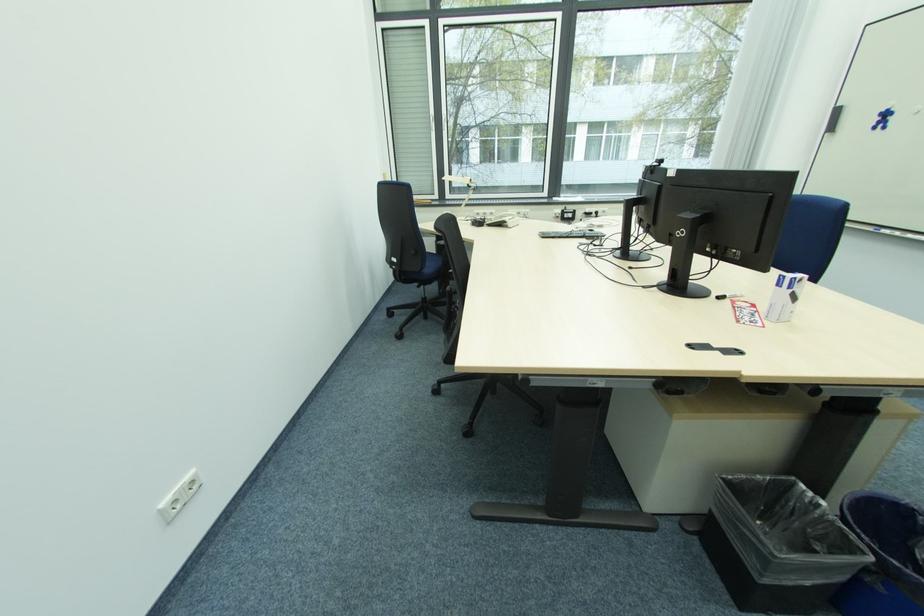
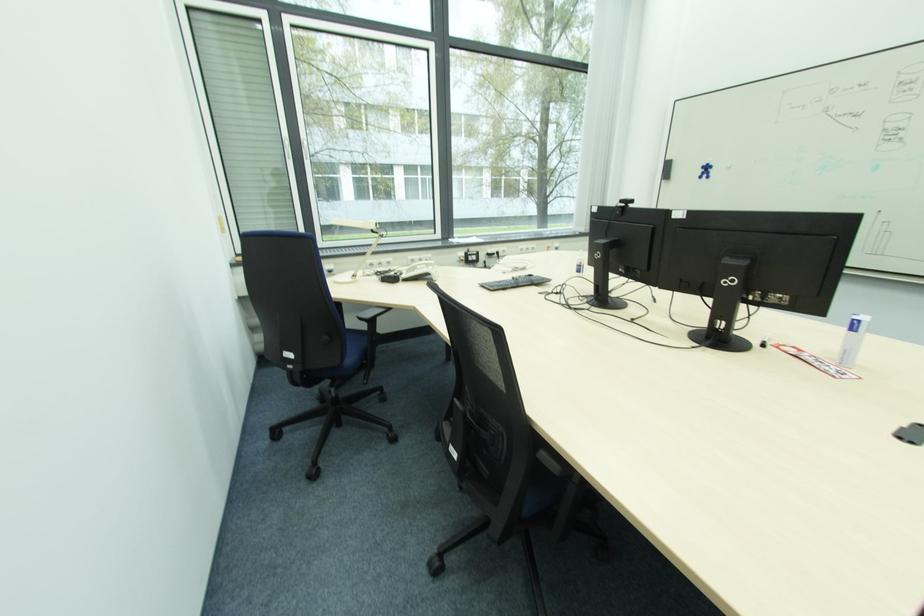
Question: The camera is either moving clockwise (left) or counter-clockwise (right) around the object. The first image is from the beginning of the video and the second image is from the end. Is the camera moving left or right when shooting the video?

Choices:
 (A) Left
 (B) Right

Answer: (A)